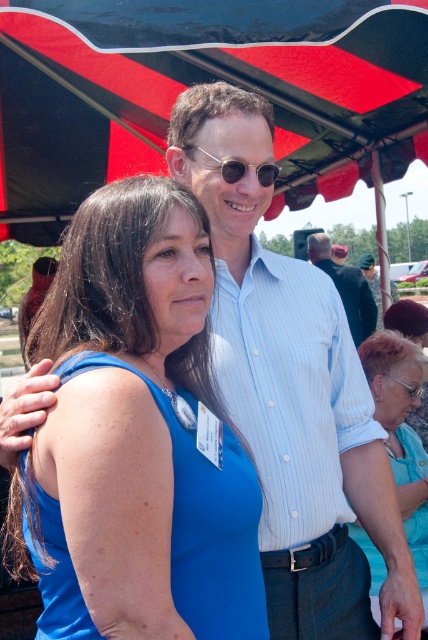
Does point (419, 486) come closer to viewer compared to point (261, 182)?

No, (419, 486) is behind (261, 182).

Can you confirm if blue fabric dress at center is positioned to the left of sunglasses at center?

No, blue fabric dress at center is not to the left of sunglasses at center.

Does point (419, 400) lie in front of point (228, 179)?

That is False.

Identify the location of blue fabric dress at center. The width and height of the screenshot is (428, 640). (401, 429).

Does blue matte dress at lower left appear on the right side of dark blue uniform at center?

In fact, blue matte dress at lower left is to the left of dark blue uniform at center.

Which is behind, point (181, 496) or point (377, 282)?

The point (377, 282) is behind.

This screenshot has height=640, width=428. What are the coordinates of `blue matte dress at lower left` in the screenshot? It's located at (207, 525).

Does blue fabric dress at center have a greater height compared to dark blue shirt at center?

In fact, blue fabric dress at center may be shorter than dark blue shirt at center.

This screenshot has height=640, width=428. Describe the element at coordinates (401, 429) in the screenshot. I see `blue fabric dress at center` at that location.

Where is `blue fabric dress at center`? Image resolution: width=428 pixels, height=640 pixels. blue fabric dress at center is located at coordinates (401, 429).